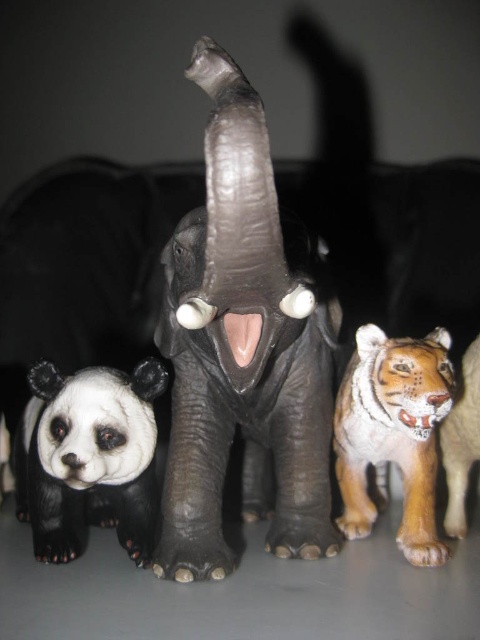
Does black and white plush panda at lower left have a greater height compared to orange-brown fur tiger at right?

No.

Who is more distant from viewer, (118, 388) or (445, 339)?

The point (445, 339) is more distant.

Locate an element on the screen. This screenshot has width=480, height=640. black and white plush panda at lower left is located at coordinates (88, 458).

Is point (178, 360) behind point (52, 561)?

Yes, point (178, 360) is behind point (52, 561).

How distant is black matte/painted panda at center-left from black and white plush panda at lower left?

black matte/painted panda at center-left is 5.78 inches from black and white plush panda at lower left.

Which is in front, point (200, 536) or point (152, 372)?

Point (200, 536) is in front.

This screenshot has height=640, width=480. Find the location of `black matte/painted panda at center-left`. black matte/painted panda at center-left is located at coordinates (241, 349).

Can you confirm if black matte/painted panda at center-left is positioned below orange-brown fur tiger at right?

Incorrect, black matte/painted panda at center-left is not positioned below orange-brown fur tiger at right.

Which is behind, point (320, 362) or point (416, 428)?

The point (320, 362) is more distant.

The height and width of the screenshot is (640, 480). In order to click on black matte/painted panda at center-left in this screenshot , I will do `click(241, 349)`.